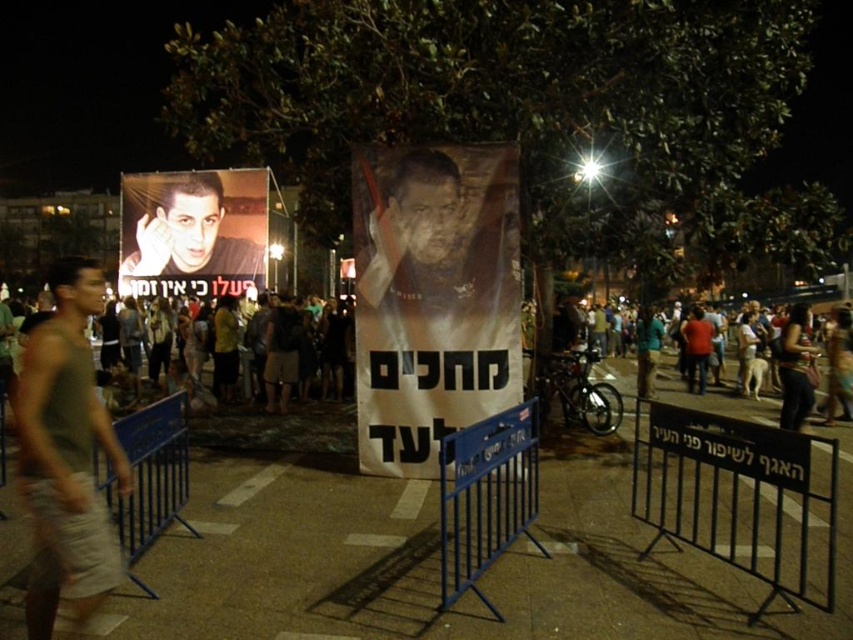
You are standing in the middle of the scene and want to walk towards the blue metal barricade at center. Which direction should you move relative to the metallic poster at center?

The metallic poster at center is to the left of the blue metal barricade at center, so you should move to the right relative to the metallic poster at center to reach the blue metal barricade at center.

You are a photographer trying to capture a clear photo of the two posters in the nighttime scene. You notice the blue metal barricade at lower left and the dark clothing crowd at center. Which object is blocking your view of the posters?

The blue metal barricade at lower left is located below dark clothing crowd at center, so the dark clothing crowd at center is blocking the view of the posters.

You are a delivery person trying to navigate through the event area. You see the metallic poster at center and the blue metal barricade at center. Which object is wider?

The metallic poster at center is wider than the blue metal barricade at center.